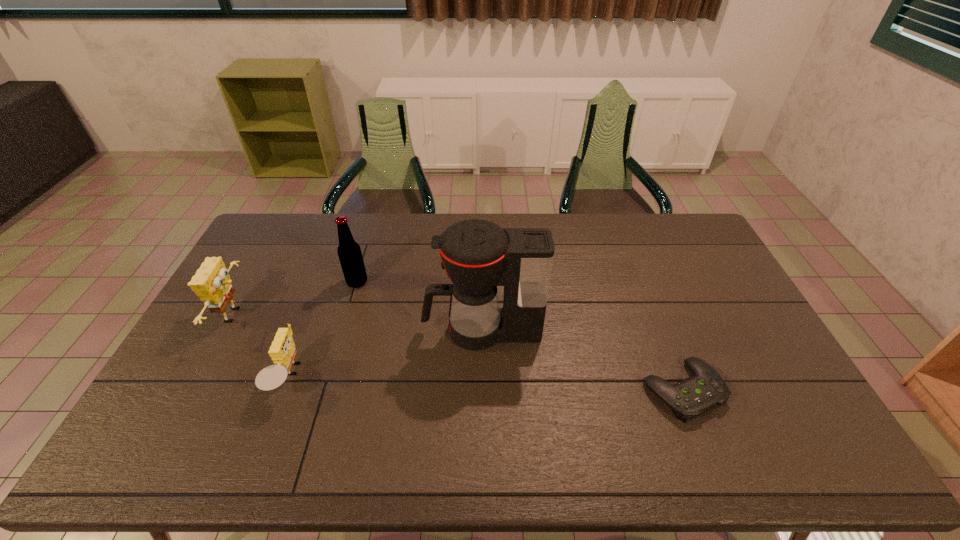
You are a GUI agent. You are given a task and a screenshot of the screen. Output one action in this format:
    pyautogui.click(x=<x>, y=<y>)
    Task: Click on the vacant space located pour from the carafe of the coffee maker
    The height and width of the screenshot is (540, 960).
    Given the screenshot: What is the action you would take?
    pyautogui.click(x=334, y=330)

Find the location of `free location located pour from the carafe of the coffee maker`. free location located pour from the carafe of the coffee maker is located at coordinates (367, 330).

At what (x,y) coordinates should I click in order to perform the action: click on vacant space located pour from the carafe of the coffee maker. Please return your answer as a coordinate pair (x, y). Image resolution: width=960 pixels, height=540 pixels. Looking at the image, I should click on (371, 330).

Identify the location of free space located 0.200m on the front of the fourth shortest object. tap(341, 336).

Identify the location of vacant space situated 0.320m on the face of the leftmost object. point(349,315).

Find the location of a particular element. vacant space located on the front-facing side of the right sponge is located at coordinates (335, 377).

Where is `vacant space situated on the left of the shortest object`? The width and height of the screenshot is (960, 540). vacant space situated on the left of the shortest object is located at coordinates (582, 390).

Where is `object at the left edge`? object at the left edge is located at coordinates (212, 283).

Identify the location of vacant space at the far edge. (454, 217).

The height and width of the screenshot is (540, 960). What are the coordinates of `vacant space at the near edge` in the screenshot? It's located at (489, 452).